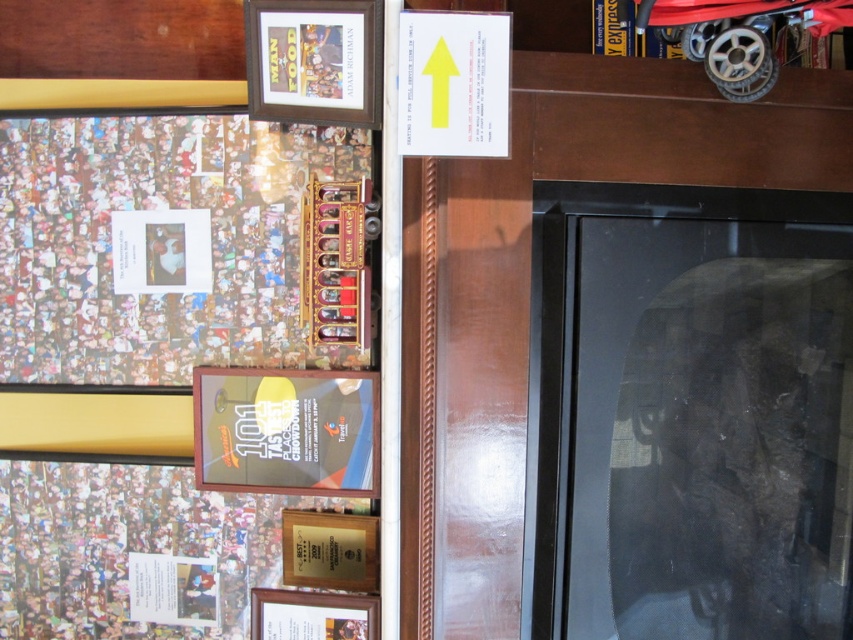
You are standing in the museum facing the rotated image. There are two points marked in the scene. The first point is at coordinates point (x=322, y=388) and the second is at point (x=329, y=516). Which point is closer to you?

Point (x=322, y=388) is in front of point (x=329, y=516), so the first point is closer to you.

You are an art installer who needs to hang a new sign between the matte plastic picture frame at center and the wooden plaque at lower center. Based on the current arrangement, which object should the new sign be placed to the right of?

The new sign should be placed to the right of the matte plastic picture frame at center because it is to the left of the wooden plaque at lower center.

You are an art curator standing in front of the display case. You need to place a new label between the brown wooden picture frame at upper center and the wooden plaque at lower center. Based on their positions, where should the label be placed?

The label should be placed to the right of the brown wooden picture frame at upper center since it is to the left of the wooden plaque at lower center.